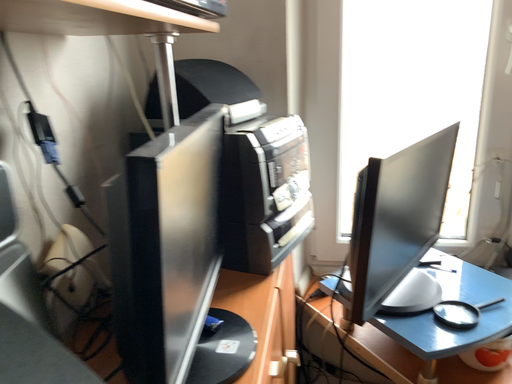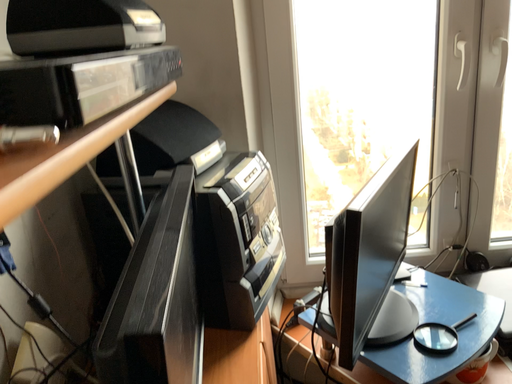
Question: Which way did the camera rotate in the video?

Choices:
 (A) rotated left
 (B) rotated right

Answer: (B)